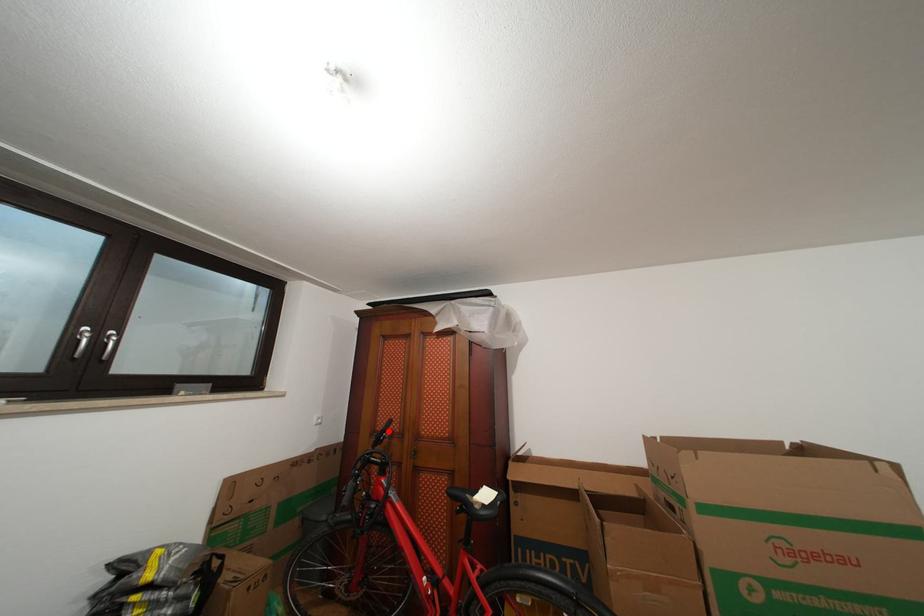
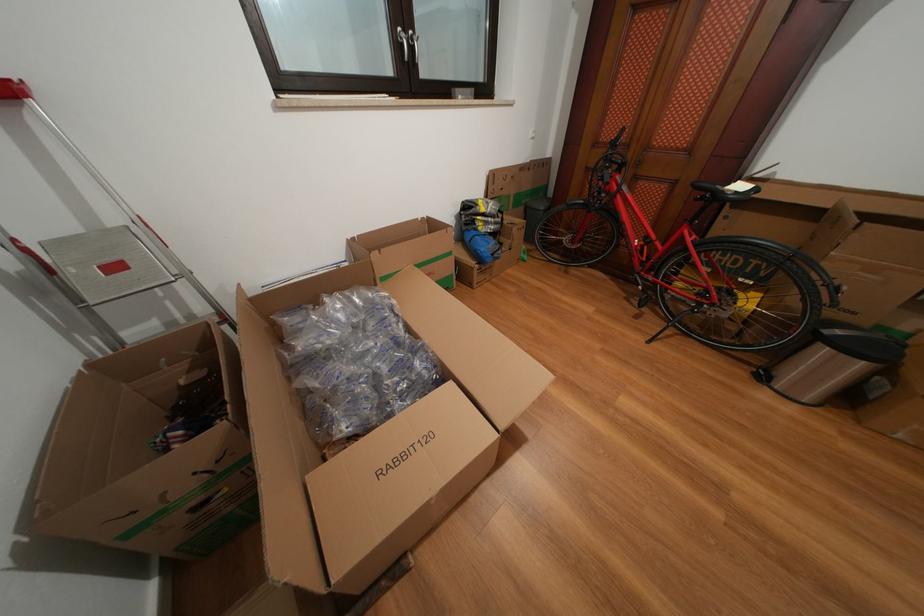
Question: I am providing you with two images of the same scene from different viewpoints. A red point is marked on the first image. Can you still see the location of the red point in image 2?

Choices:
 (A) Yes
 (B) No

Answer: (A)